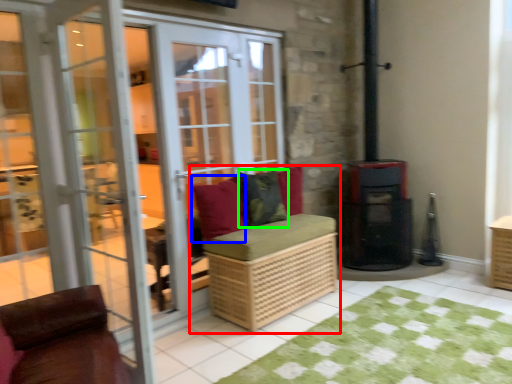
Question: Estimate the real-world distances between objects in this image. Which object is closer to furniture (highlighted by a red box), pillow (highlighted by a blue box) or pillow (highlighted by a green box)?

Choices:
 (A) pillow
 (B) pillow

Answer: (A)